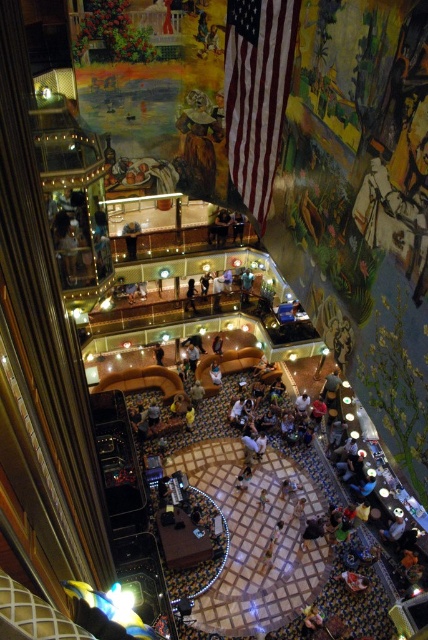
You are standing on the raised platform in the central area and want to greet the person wearing the dark blue shirt at center. Which direction should you look to see the silhouette of person at center?

The silhouette of person at center is in front of the dark blue shirt at center, so you should look forward to see them.

You are sitting on the light brown leather couch at center and want to move to the dark brown leather couch at center. Which direction should you move to reach it?

You should move to the right because the light brown leather couch at center is to the left of the dark brown leather couch at center.

Looking at this image, you are standing at the entrance of this grand venue and see the silhouette of person at center and the dark brown leather couch at center. Which object is located to the left when viewed from your position?

The silhouette of person at center is positioned on the left side of dark brown leather couch at center, so from your viewpoint at the entrance, the silhouette of person at center is to the left of the dark brown leather couch at center.